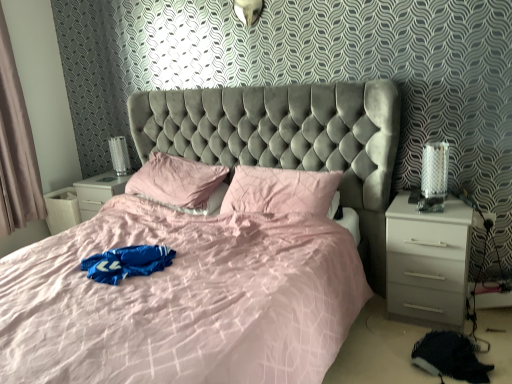
Question: Is light beige fabric curtain at left at the left side of white glossy nightstand at right?

Choices:
 (A) no
 (B) yes

Answer: (B)

Question: Considering the relative sizes of light beige fabric curtain at left and white glossy nightstand at right in the image provided, is light beige fabric curtain at left bigger than white glossy nightstand at right?

Choices:
 (A) yes
 (B) no

Answer: (A)

Question: Is white glossy nightstand at right completely or partially inside light beige fabric curtain at left?

Choices:
 (A) yes
 (B) no

Answer: (B)

Question: Considering the relative sizes of light beige fabric curtain at left and white glossy nightstand at right in the image provided, is light beige fabric curtain at left smaller than white glossy nightstand at right?

Choices:
 (A) yes
 (B) no

Answer: (B)

Question: Are light beige fabric curtain at left and white glossy nightstand at right far apart?

Choices:
 (A) no
 (B) yes

Answer: (B)

Question: Is light beige fabric curtain at left touching white glossy nightstand at right?

Choices:
 (A) no
 (B) yes

Answer: (A)

Question: Is metallic silver table lamp at right, the 1th table lamp in the front-to-back sequence, directly adjacent to pink fabric pillow at center?

Choices:
 (A) yes
 (B) no

Answer: (B)

Question: Can you confirm if metallic silver table lamp at right, placed as the 1th table lamp when sorted from right to left, is taller than pink fabric pillow at center?

Choices:
 (A) yes
 (B) no

Answer: (A)

Question: Can you confirm if metallic silver table lamp at right, placed as the 1th table lamp when sorted from right to left, is wider than pink fabric pillow at center?

Choices:
 (A) no
 (B) yes

Answer: (A)

Question: Does metallic silver table lamp at right, which is the second table lamp from back to front, turn towards pink fabric pillow at center?

Choices:
 (A) no
 (B) yes

Answer: (A)

Question: Are metallic silver table lamp at right, placed as the 1th table lamp when sorted from right to left, and pink fabric pillow at center far apart?

Choices:
 (A) yes
 (B) no

Answer: (B)

Question: Is metallic silver table lamp at right, which is the second table lamp from back to front, to the left of pink fabric pillow at center from the viewer's perspective?

Choices:
 (A) no
 (B) yes

Answer: (A)

Question: Is pink fabric pillow at center located within light beige fabric curtain at left?

Choices:
 (A) yes
 (B) no

Answer: (B)